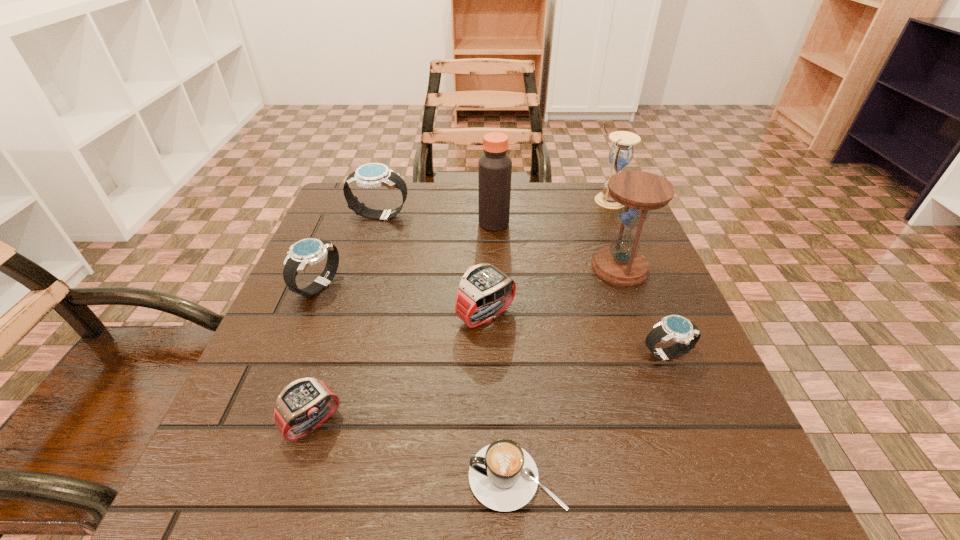
Locate an element on the screen. The height and width of the screenshot is (540, 960). object present at the far left corner is located at coordinates (373, 175).

Image resolution: width=960 pixels, height=540 pixels. Find the location of `object present at the far right corner`. object present at the far right corner is located at coordinates (621, 153).

Where is `free space at the far edge of the desktop`? This screenshot has height=540, width=960. free space at the far edge of the desktop is located at coordinates (437, 214).

In the image, there is a desktop. Where is `free space at the near edge`? free space at the near edge is located at coordinates (615, 489).

Locate an element on the screen. This screenshot has width=960, height=540. blank space at the left edge is located at coordinates (254, 456).

Where is `vacant area at the right edge of the desktop`? This screenshot has height=540, width=960. vacant area at the right edge of the desktop is located at coordinates (660, 293).

Locate an element on the screen. Image resolution: width=960 pixels, height=540 pixels. free location at the far left corner of the desktop is located at coordinates (379, 233).

What are the coordinates of `vacant space at the far right corner` in the screenshot? It's located at (588, 202).

At what (x,y) coordinates should I click in order to perform the action: click on free spot between the left red watch and the bigger red watch. Please return your answer as a coordinate pair (x, y). Looking at the image, I should click on (399, 369).

Locate an element on the screen. This screenshot has height=540, width=960. empty space that is in between the nearest watch and the nearer hourglass is located at coordinates (467, 345).